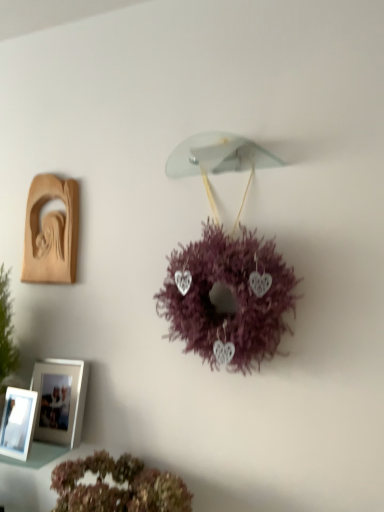
Question: Is white glossy picture frame at lower left, arranged as the 2th picture frame when viewed from the top, wider or thinner than white glossy picture frame at lower left, the third picture frame when ordered from top to bottom?

Choices:
 (A) wide
 (B) thin

Answer: (B)

Question: Is point (76, 411) closer or farther from the camera than point (23, 400)?

Choices:
 (A) closer
 (B) farther

Answer: (B)

Question: Which is nearer to the fluffy pink wreath at lower center, the 1th flower from the bottom?

Choices:
 (A) wooden carving at left, which ranks as the first picture frame in top-to-bottom order
 (B) white glossy picture frame at lower left, the 1th picture frame when ordered from bottom to top
 (C) white glossy picture frame at lower left, arranged as the 2th picture frame when viewed from the top
 (D) purple fluffy wreath at center, the second flower positioned from the bottom

Answer: (C)

Question: Which of these objects is positioned closest to the white glossy picture frame at lower left, which is counted as the second picture frame, starting from the bottom?

Choices:
 (A) wooden carving at left, which appears as the third picture frame when ordered from the bottom
 (B) white glossy picture frame at lower left, the 1th picture frame when ordered from bottom to top
 (C) fluffy pink wreath at lower center, the 1th flower from the bottom
 (D) purple fluffy wreath at center, the second flower positioned from the bottom

Answer: (B)